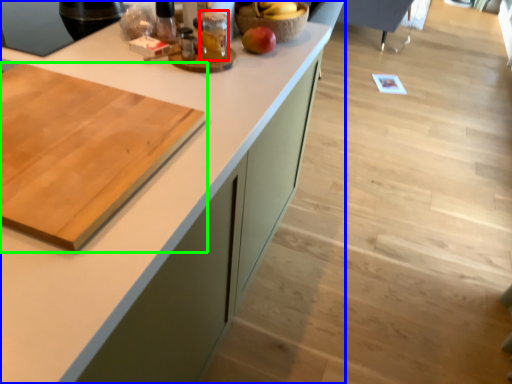
Question: Which is nearer to the beverage (highlighted by a red box)? countertop (highlighted by a blue box) or cutting board (highlighted by a green box).

Choices:
 (A) countertop
 (B) cutting board

Answer: (A)